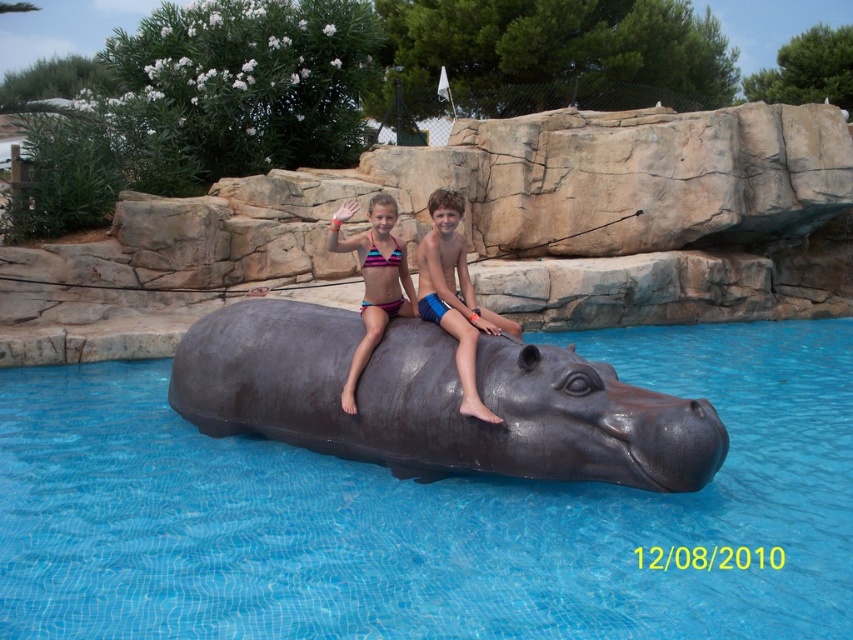
Does glossy plastic hippo at center have a lesser height compared to striped fabric bikini at center?

Yes.

Looking at this image, measure the distance from glossy plastic hippo at center to striped fabric bikini at center.

glossy plastic hippo at center and striped fabric bikini at center are 8.35 feet apart from each other.

Is point (654, 573) closer to camera compared to point (361, 356)?

Yes, it is.

Find the location of `glossy plastic hippo at center`. glossy plastic hippo at center is located at coordinates tap(430, 515).

Is shiny dark gray hippo at center bigger than striped fabric bikini at center?

Correct, shiny dark gray hippo at center is larger in size than striped fabric bikini at center.

Which is behind, point (241, 348) or point (386, 228)?

Positioned behind is point (386, 228).

The height and width of the screenshot is (640, 853). I want to click on shiny dark gray hippo at center, so click(434, 401).

Can you confirm if shiny dark gray hippo at center is smaller than blue matte/soft shorts at center?

Actually, shiny dark gray hippo at center might be larger than blue matte/soft shorts at center.

Does shiny dark gray hippo at center appear on the left side of blue matte/soft shorts at center?

Indeed, shiny dark gray hippo at center is positioned on the left side of blue matte/soft shorts at center.

Does point (305, 392) come behind point (440, 289)?

That is False.

Find the location of a particular element. The width and height of the screenshot is (853, 640). shiny dark gray hippo at center is located at coordinates (434, 401).